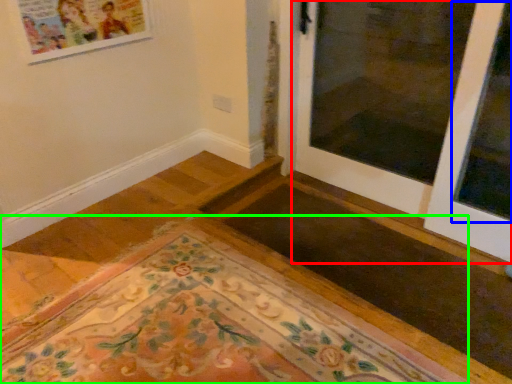
Question: Based on their relative distances, which object is nearer to door (highlighted by a red box)? Choose from window (highlighted by a blue box) and mat (highlighted by a green box).

Choices:
 (A) window
 (B) mat

Answer: (A)